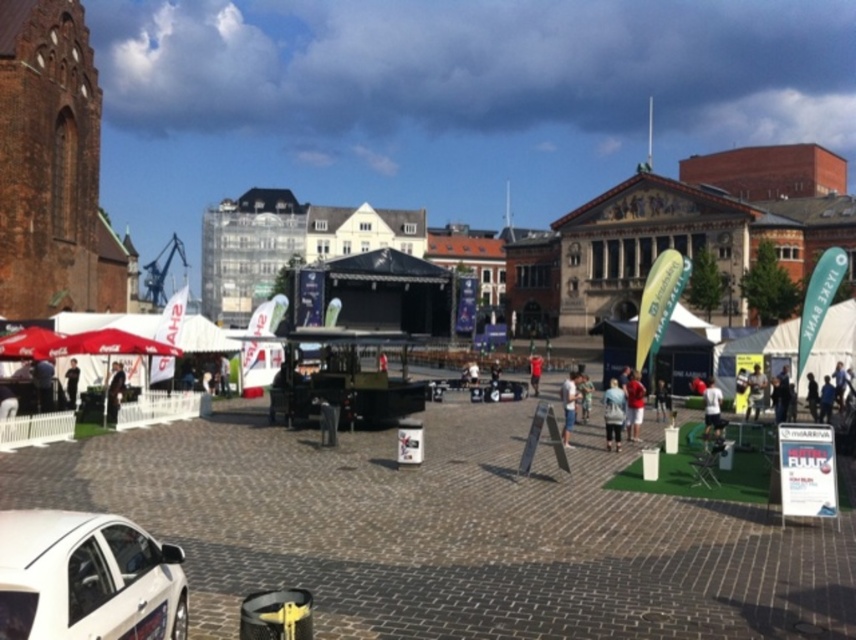
Which of these two, white matte shirt at center or matte black jacket at left, stands shorter?

With less height is matte black jacket at left.

I want to click on white matte shirt at center, so click(x=712, y=408).

This screenshot has height=640, width=856. I want to click on white matte shirt at center, so click(712, 408).

The image size is (856, 640). I want to click on dark brown leather jacket at left, so click(x=114, y=392).

What do you see at coordinates (114, 392) in the screenshot? I see `dark brown leather jacket at left` at bounding box center [114, 392].

You are a GUI agent. You are given a task and a screenshot of the screen. Output one action in this format:
    pyautogui.click(x=<x>, y=<y>)
    Task: Click on the dark brown leather jacket at left
    
    Given the screenshot: What is the action you would take?
    pyautogui.click(x=114, y=392)

Where is `white matte car at lower left`? Image resolution: width=856 pixels, height=640 pixels. white matte car at lower left is located at coordinates (87, 579).

Is point (92, 593) behind point (117, 410)?

No, it is in front of (117, 410).

Describe the element at coordinates (87, 579) in the screenshot. The image size is (856, 640). I see `white matte car at lower left` at that location.

The height and width of the screenshot is (640, 856). Identify the location of white matte car at lower left. (87, 579).